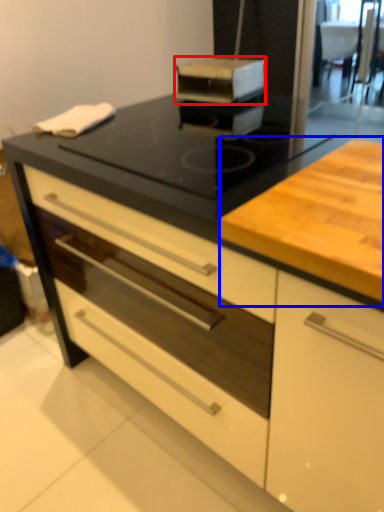
Question: Which point is closer to the camera, kitchen appliance (highlighted by a red box) or counter (highlighted by a blue box)?

Choices:
 (A) kitchen appliance
 (B) counter

Answer: (B)